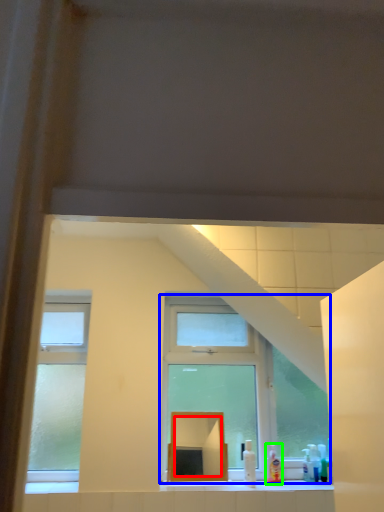
Question: Which object is the farthest from mirror (highlighted by a red box)? Choose among these: window (highlighted by a blue box) or toiletry (highlighted by a green box).

Choices:
 (A) window
 (B) toiletry

Answer: (B)